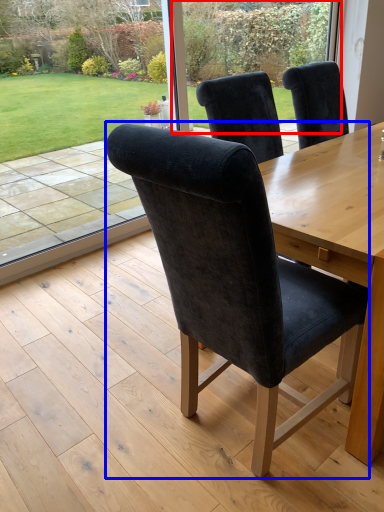
Question: Which object appears farthest to the camera in this image, glass door (highlighted by a red box) or chair (highlighted by a blue box)?

Choices:
 (A) glass door
 (B) chair

Answer: (A)